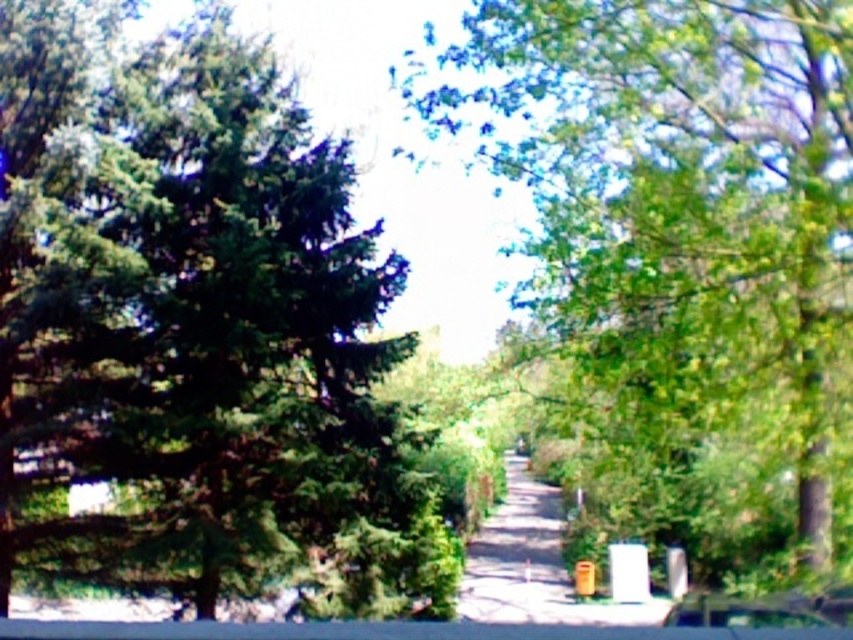
You are a pedestrian walking along the tree lined pathway and see the green leafy tree at center and the metallic silver car at center. Which object is located to the right of the other?

The green leafy tree at center is positioned on the right side of metallic silver car at center.

You are standing at the entrance of the smooth concrete path at center. You want to walk to the end of the path. Approximately how far will you have to walk?

The distance of smooth concrete path at center from viewer is 81.95 feet, so you will have to walk approximately 81.95 feet to reach the end of the path.